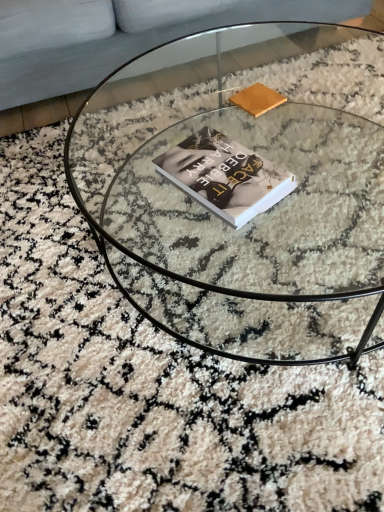
Image resolution: width=384 pixels, height=512 pixels. In order to click on free point behind hardcover book at center in this screenshot , I will do `click(218, 125)`.